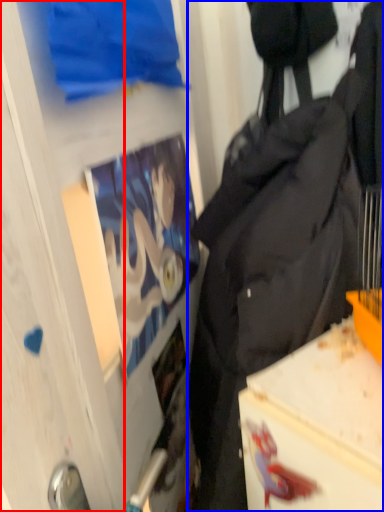
Question: Which object is closer to the camera taking this photo, glass door (highlighted by a red box) or backpack (highlighted by a blue box)?

Choices:
 (A) glass door
 (B) backpack

Answer: (A)